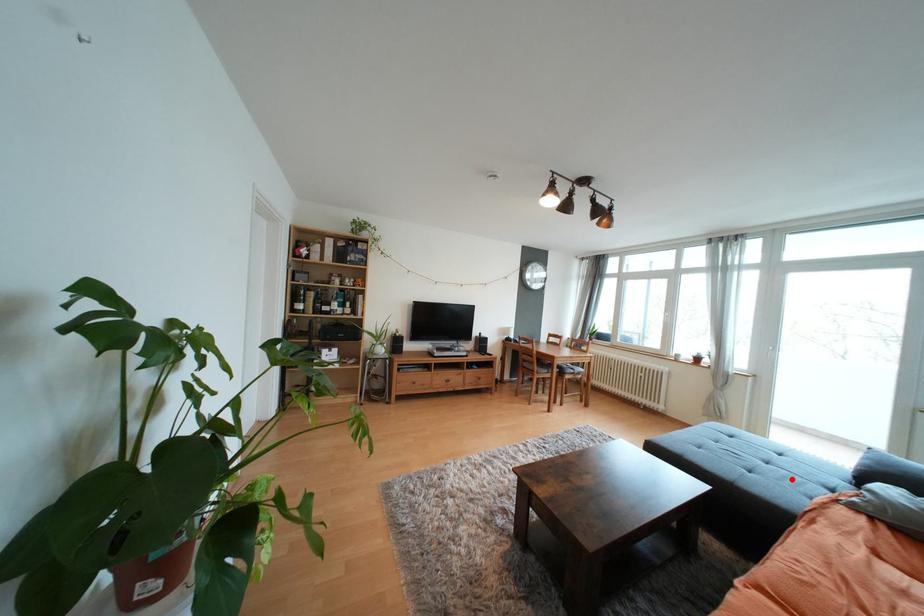
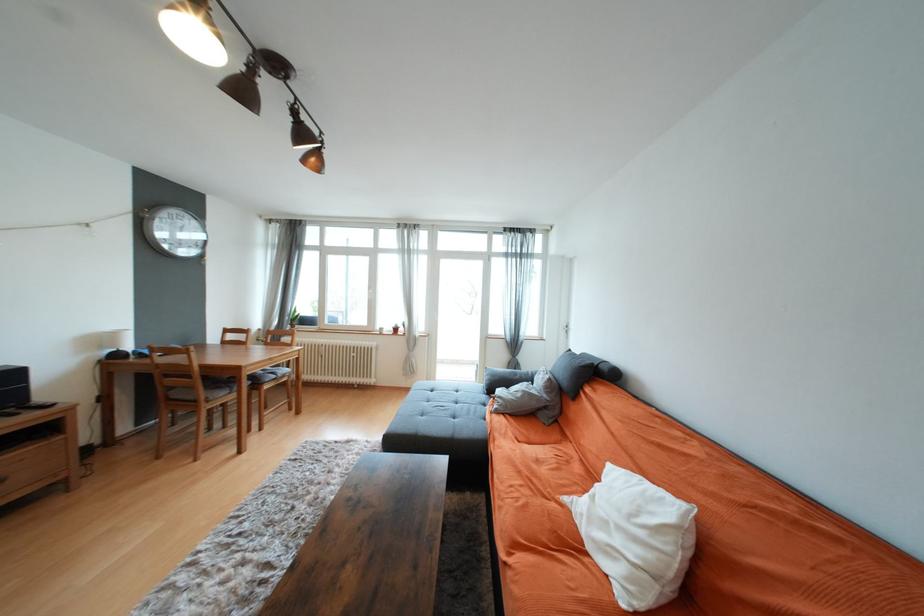
Question: A red point is marked in image1. In image2, is the corresponding 3D point closer to the camera or farther? Reply with the corresponding letter.

Choices:
 (A) The corresponding 3D point is closer.
 (B) The corresponding 3D point is farther.

Answer: (A)